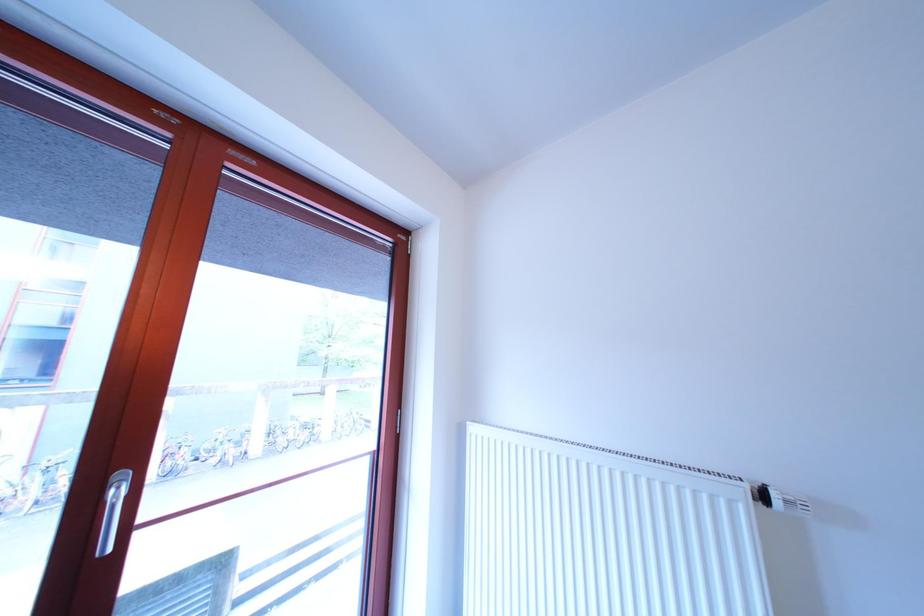
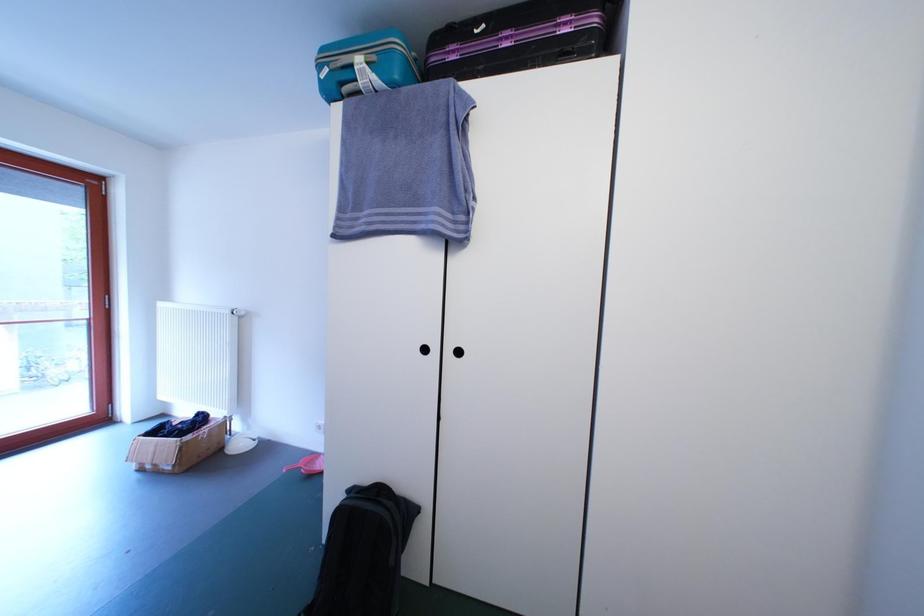
In a continuous first-person perspective shot, in which direction is the camera moving?

The movement direction of the cameraman is right, backward.